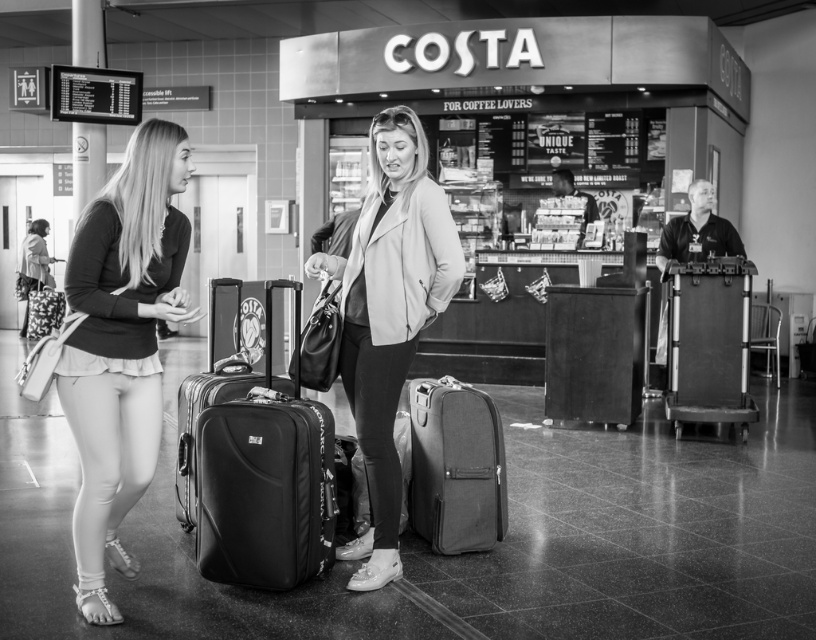
Measure the distance between leather jacket at center and camera.

leather jacket at center is 4.04 meters away from camera.

Does leather jacket at center have a larger size compared to canvas suitcase at center?

Yes, leather jacket at center is bigger than canvas suitcase at center.

Identify the location of leather jacket at center. [x=389, y=316].

The width and height of the screenshot is (816, 640). I want to click on leather jacket at center, so click(x=389, y=316).

Can you confirm if matte black top at left is thinner than matte black suitcase at center?

No.

Which of these two, matte black top at left or matte black suitcase at center, stands shorter?

With less height is matte black suitcase at center.

Between point (125, 195) and point (251, 552), which one is positioned in front?

Positioned in front is point (125, 195).

The width and height of the screenshot is (816, 640). I want to click on matte black top at left, so click(x=122, y=346).

Between matte black suitcase at center and metallic suitcase at right, which one is positioned higher?

metallic suitcase at right is above.

Is matte black suitcase at center closer to the viewer compared to metallic suitcase at right?

Yes, it is.

Where is `matte black suitcase at center`? matte black suitcase at center is located at coordinates (265, 477).